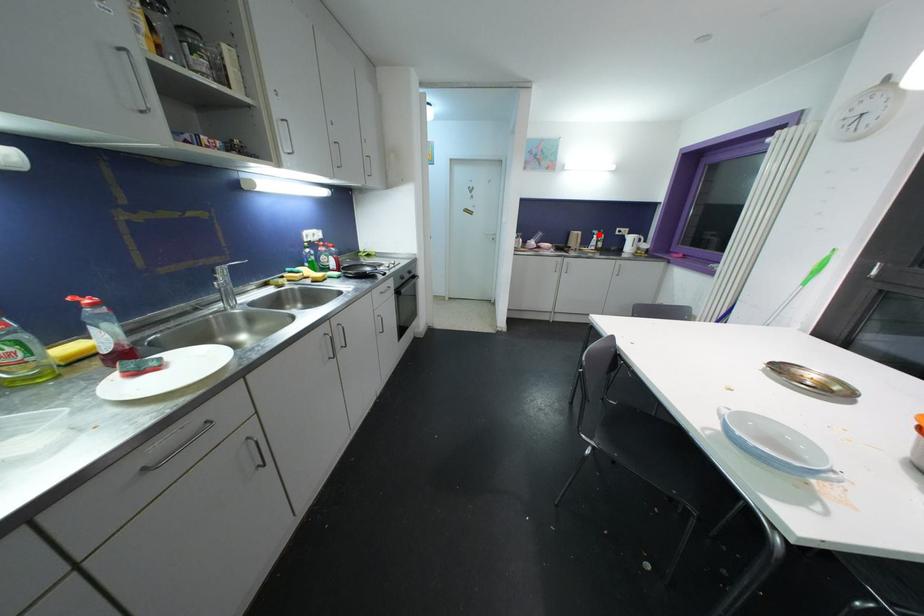
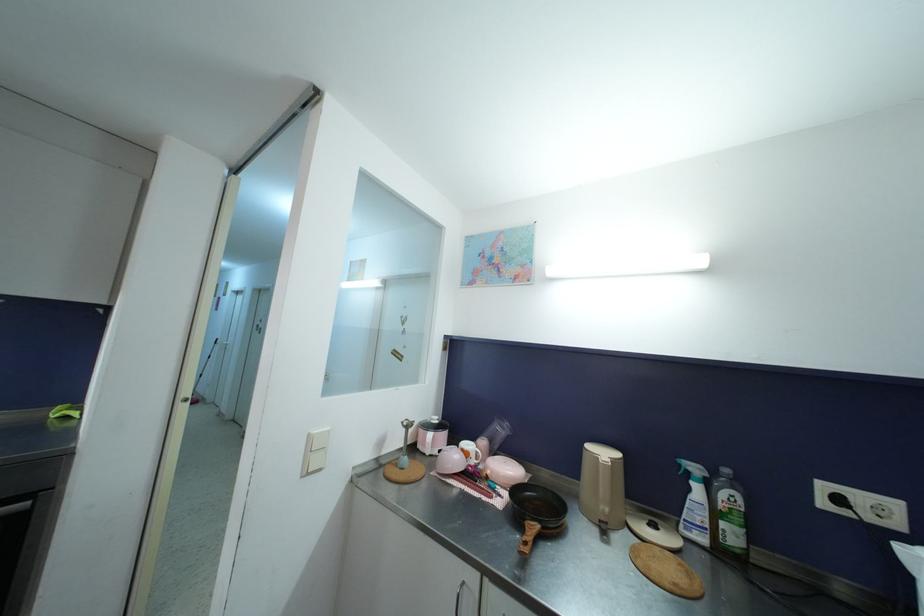
Question: I am providing you with two images of the same scene from different viewpoints. Given a red point in image1, look at the same physical point in image2. Is it:

Choices:
 (A) Closer to the viewpoint
 (B) Farther from the viewpoint

Answer: (B)